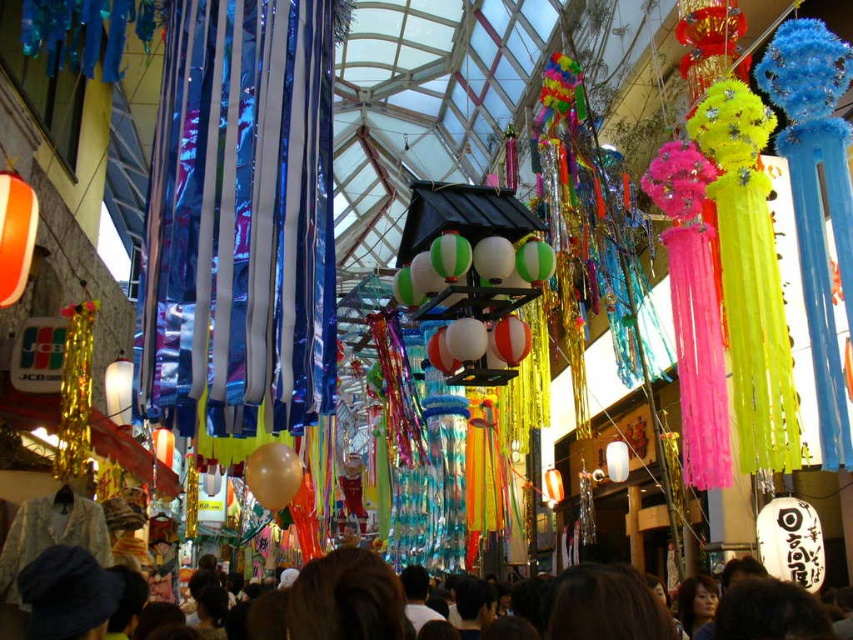
Can you confirm if brown hair at center is shorter than green and white striped balloons at center?

Correct, brown hair at center is not as tall as green and white striped balloons at center.

Which is in front, point (74, 572) or point (491, 376)?

Point (74, 572)

Based on the photo, measure the distance between brown hair at center and camera.

They are 167.12 feet apart.

Where is `brown hair at center`? The width and height of the screenshot is (853, 640). brown hair at center is located at coordinates (344, 598).

Between green and white striped balloons at center and translucent gold balloon at center, which one appears on the left side from the viewer's perspective?

translucent gold balloon at center is more to the left.

Does green and white striped balloons at center appear over translucent gold balloon at center?

Indeed, green and white striped balloons at center is positioned over translucent gold balloon at center.

This screenshot has width=853, height=640. Find the location of `green and white striped balloons at center`. green and white striped balloons at center is located at coordinates (477, 301).

Who is more distant from viewer, [633,595] or [282,474]?

The point [282,474] is behind.

Is brown hair at center further to camera compared to translucent gold balloon at center?

No, brown hair at center is closer to the viewer.

The image size is (853, 640). What do you see at coordinates (344, 598) in the screenshot?
I see `brown hair at center` at bounding box center [344, 598].

Locate an element on the screen. brown hair at center is located at coordinates (344, 598).